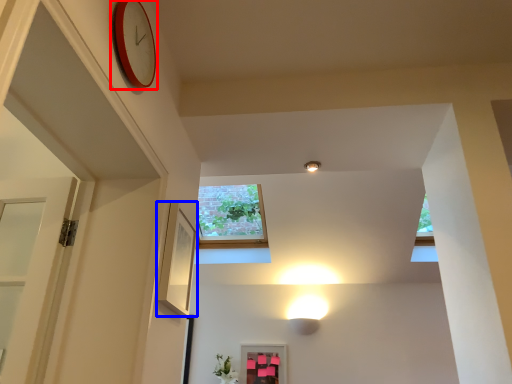
Question: Which point is further to the camera, clock (highlighted by a red box) or picture frame (highlighted by a blue box)?

Choices:
 (A) clock
 (B) picture frame

Answer: (B)